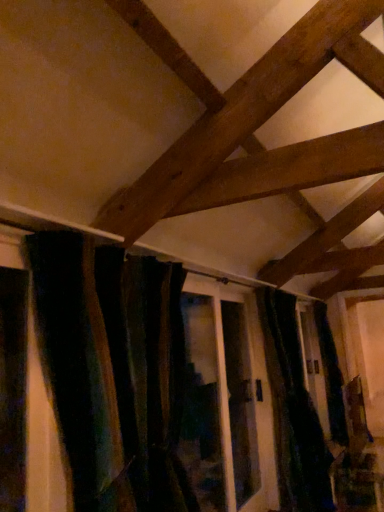
Question: Does velvet dark green curtain at center, the 1th curtain positioned from the front, have a smaller size compared to translucent glass screen door at center?

Choices:
 (A) no
 (B) yes

Answer: (B)

Question: Are velvet dark green curtain at center, the 1th curtain positioned from the front, and translucent glass screen door at center located far from each other?

Choices:
 (A) no
 (B) yes

Answer: (B)

Question: Can you confirm if velvet dark green curtain at center, which is the second curtain in right-to-left order, is taller than translucent glass screen door at center?

Choices:
 (A) no
 (B) yes

Answer: (A)

Question: Is velvet dark green curtain at center, which is the second curtain in right-to-left order, facing towards translucent glass screen door at center?

Choices:
 (A) no
 (B) yes

Answer: (A)

Question: Is velvet dark green curtain at center, which is the second curtain in right-to-left order, looking in the opposite direction of translucent glass screen door at center?

Choices:
 (A) yes
 (B) no

Answer: (B)

Question: In terms of height, does velvet dark green curtain at center, which is the second curtain in left-to-right order, look taller or shorter compared to velvet dark green curtain at center, the 1th curtain positioned from the front?

Choices:
 (A) tall
 (B) short

Answer: (A)

Question: Relative to velvet dark green curtain at center, which is the 2th curtain from back to front, is velvet dark green curtain at center, the 1th curtain viewed from the right, in front or behind?

Choices:
 (A) front
 (B) behind

Answer: (B)

Question: Choose the correct answer: Is velvet dark green curtain at center, which ranks as the first curtain in back-to-front order, inside velvet dark green curtain at center, the 1th curtain positioned from the front, or outside it?

Choices:
 (A) inside
 (B) outside

Answer: (B)

Question: Based on their sizes in the image, would you say velvet dark green curtain at center, acting as the second curtain starting from the front, is bigger or smaller than velvet dark green curtain at center, which is the second curtain in right-to-left order?

Choices:
 (A) big
 (B) small

Answer: (A)

Question: Does point (292, 508) appear closer or farther from the camera than point (221, 359)?

Choices:
 (A) farther
 (B) closer

Answer: (A)

Question: In terms of size, does velvet dark green curtain at center, acting as the second curtain starting from the front, appear bigger or smaller than translucent glass screen door at center?

Choices:
 (A) big
 (B) small

Answer: (A)

Question: From the image's perspective, is velvet dark green curtain at center, which is the second curtain in left-to-right order, located above or below translucent glass screen door at center?

Choices:
 (A) below
 (B) above

Answer: (A)

Question: From their relative heights in the image, would you say velvet dark green curtain at center, which is the second curtain in left-to-right order, is taller or shorter than translucent glass screen door at center?

Choices:
 (A) tall
 (B) short

Answer: (A)

Question: Considering the positions of translucent glass screen door at center and velvet dark green curtain at center, which is the second curtain in right-to-left order, in the image, is translucent glass screen door at center taller or shorter than velvet dark green curtain at center, which is the second curtain in right-to-left order,?

Choices:
 (A) short
 (B) tall

Answer: (B)

Question: In the image, is translucent glass screen door at center on the left side or the right side of velvet dark green curtain at center, which is the second curtain in right-to-left order?

Choices:
 (A) right
 (B) left

Answer: (A)